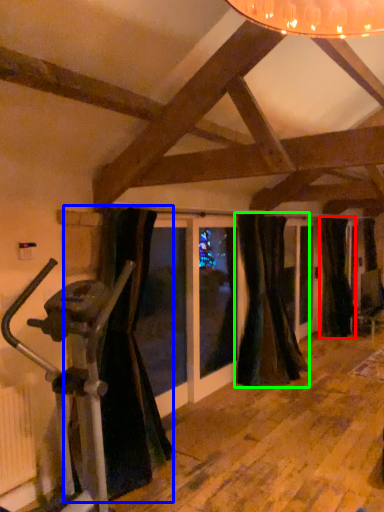
Question: Which is nearer to the curtain (highlighted by a red box)? curtain (highlighted by a blue box) or curtain (highlighted by a green box).

Choices:
 (A) curtain
 (B) curtain

Answer: (B)